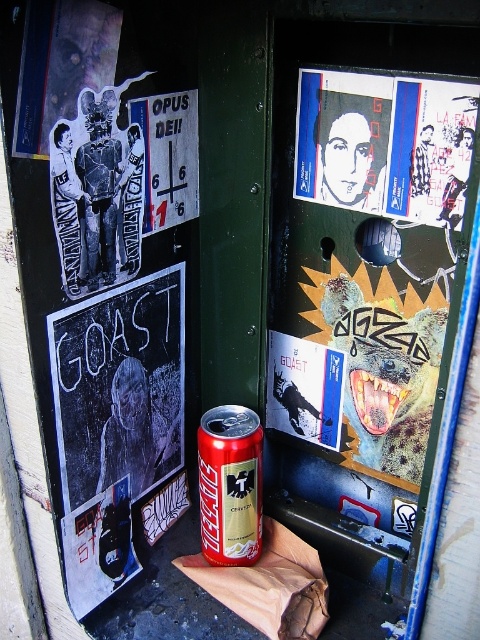
Question: Which is nearer to the black chalkboard at left?

Choices:
 (A) metallic gold beer can at center
 (B) white paper poster at upper right

Answer: (A)

Question: Can you confirm if metallic gold beer can at center is thinner than matte paper poster at center?

Choices:
 (A) yes
 (B) no

Answer: (A)

Question: Does white paper poster at upper right appear over metallic gold beer can at center?

Choices:
 (A) yes
 (B) no

Answer: (A)

Question: Which point appears farthest from the camera in this image?

Choices:
 (A) (307, 125)
 (B) (279, 339)
 (C) (204, 516)

Answer: (B)

Question: Can you confirm if white paper poster at upper right is positioned below matte paper poster at center?

Choices:
 (A) yes
 (B) no

Answer: (B)

Question: Based on their relative distances, which object is nearer to the black chalkboard at left?

Choices:
 (A) metallic gold beer can at center
 (B) white paper poster at upper right
 (C) matte paper poster at center

Answer: (A)